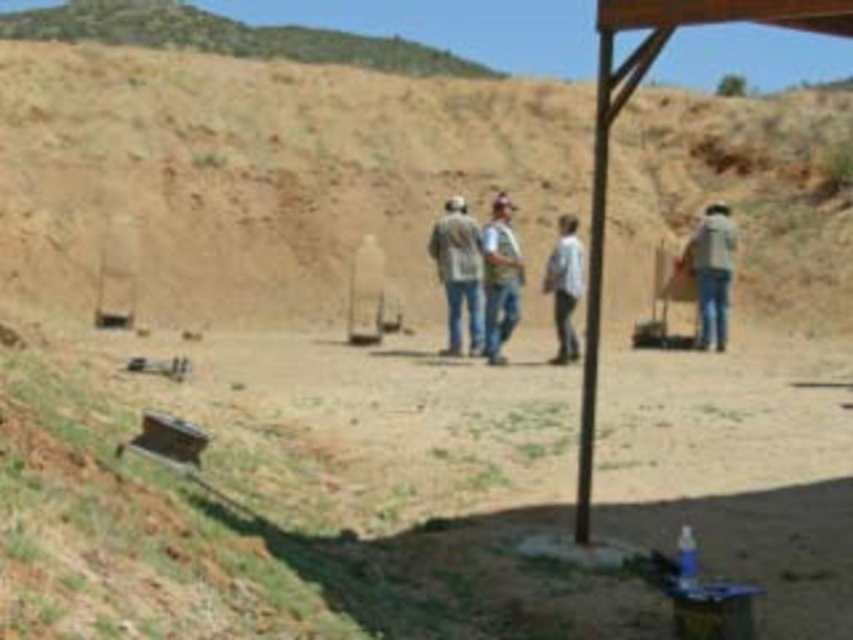
Question: Which point appears closest to the camera in this image?

Choices:
 (A) click(x=564, y=330)
 (B) click(x=834, y=220)

Answer: (A)

Question: Considering the relative positions of brown dirt hillside at upper center and white cotton shirt at center in the image provided, where is brown dirt hillside at upper center located with respect to white cotton shirt at center?

Choices:
 (A) below
 (B) above

Answer: (B)

Question: Which object is farther from the camera taking this photo?

Choices:
 (A) wooden frame at upper right
 (B) denim jacket at center
 (C) white cotton shirt at center

Answer: (B)

Question: Is denim jacket at center bigger than denim jeans at center?

Choices:
 (A) no
 (B) yes

Answer: (A)

Question: Observing the image, what is the correct spatial positioning of denim jacket at center in reference to light brown fabric jacket at right?

Choices:
 (A) left
 (B) right

Answer: (A)

Question: Which point appears closest to the camera in this image?

Choices:
 (A) [x=525, y=634]
 (B) [x=723, y=285]
 (C) [x=541, y=291]

Answer: (A)